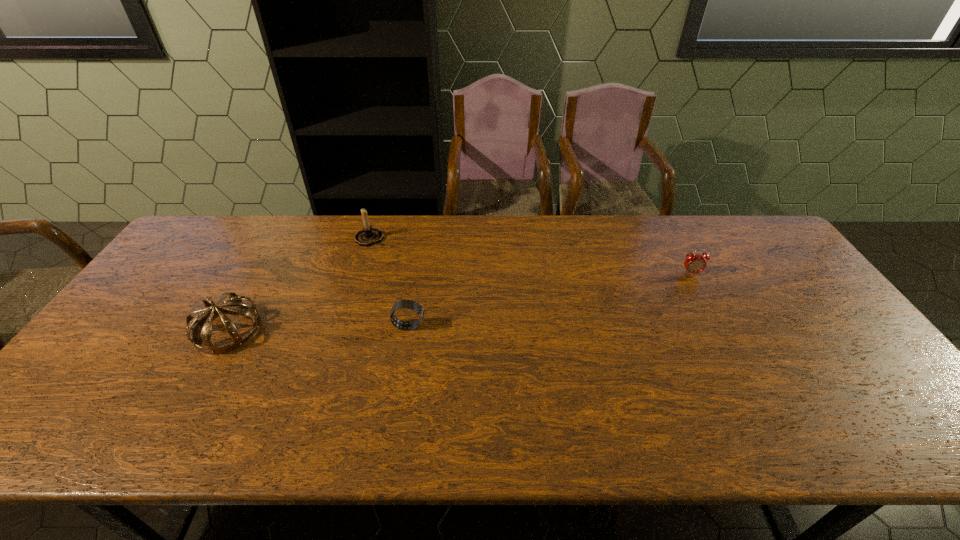
You are a GUI agent. You are given a task and a screenshot of the screen. Output one action in this format:
    pyautogui.click(x=<x>, y=<y>)
    Task: Click on the object that is at the far edge
    Image resolution: width=960 pixels, height=540 pixels.
    Given the screenshot: What is the action you would take?
    pyautogui.click(x=369, y=235)

Locate an element on the screen. Image resolution: width=960 pixels, height=540 pixels. free space at the far edge of the desktop is located at coordinates click(656, 255).

The height and width of the screenshot is (540, 960). In order to click on free space at the near edge in this screenshot , I will do `click(701, 429)`.

This screenshot has height=540, width=960. In the image, there is a desktop. What are the coordinates of `vacant space at the left edge` in the screenshot? It's located at (187, 280).

You are a GUI agent. You are given a task and a screenshot of the screen. Output one action in this format:
    pyautogui.click(x=<x>, y=<y>)
    Task: Click on the vacant space at the right edge of the desktop
    
    Given the screenshot: What is the action you would take?
    pyautogui.click(x=837, y=367)

The width and height of the screenshot is (960, 540). In the image, there is a desktop. Find the location of `vacant region at the far left corner`. vacant region at the far left corner is located at coordinates [232, 235].

This screenshot has width=960, height=540. In the image, there is a desktop. In order to click on vacant region at the far right corner in this screenshot , I will do `click(749, 220)`.

Locate an element on the screen. This screenshot has height=540, width=960. free space between the farthest object and the third object from left to right is located at coordinates (389, 282).

Find the location of a particular element. The height and width of the screenshot is (540, 960). free space between the watch and the leftmost object is located at coordinates (319, 328).

The height and width of the screenshot is (540, 960). In order to click on vacant area that lies between the watch and the alarm clock in this screenshot , I will do `click(550, 300)`.